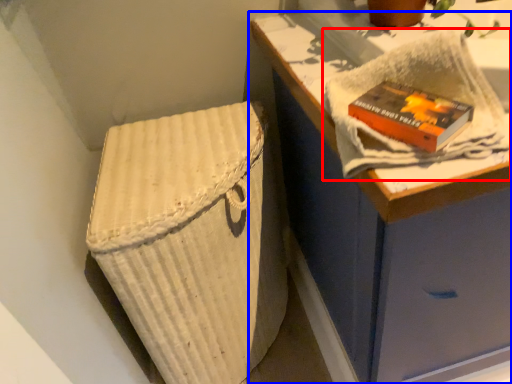
Question: Which point is closer to the camera, bath towel (highlighted by a red box) or furniture (highlighted by a blue box)?

Choices:
 (A) bath towel
 (B) furniture

Answer: (A)